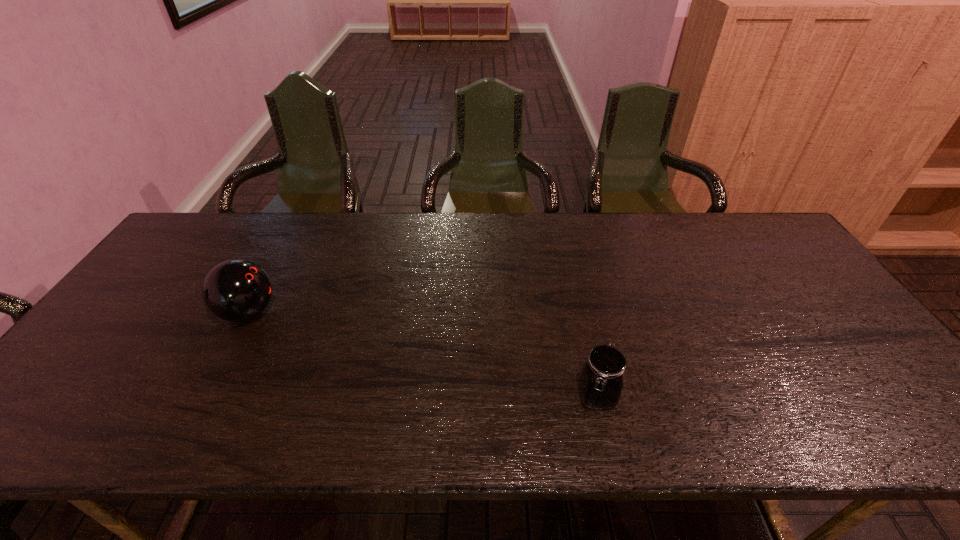
Where is `vacant area at the right edge`? This screenshot has height=540, width=960. vacant area at the right edge is located at coordinates (843, 332).

Where is `free space at the near left corner`? This screenshot has height=540, width=960. free space at the near left corner is located at coordinates (90, 428).

Locate an element on the screen. This screenshot has width=960, height=540. vacant space at the far right corner of the desktop is located at coordinates (735, 221).